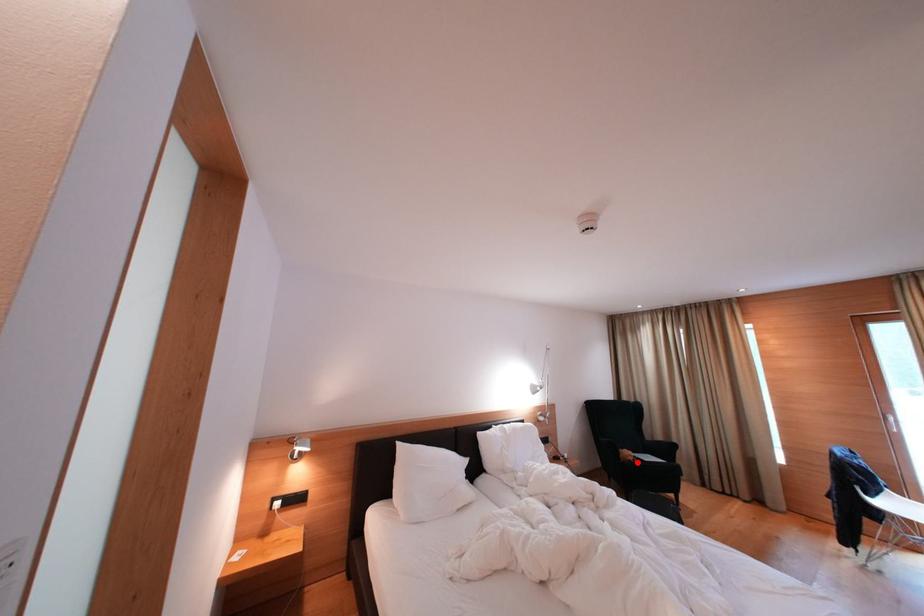
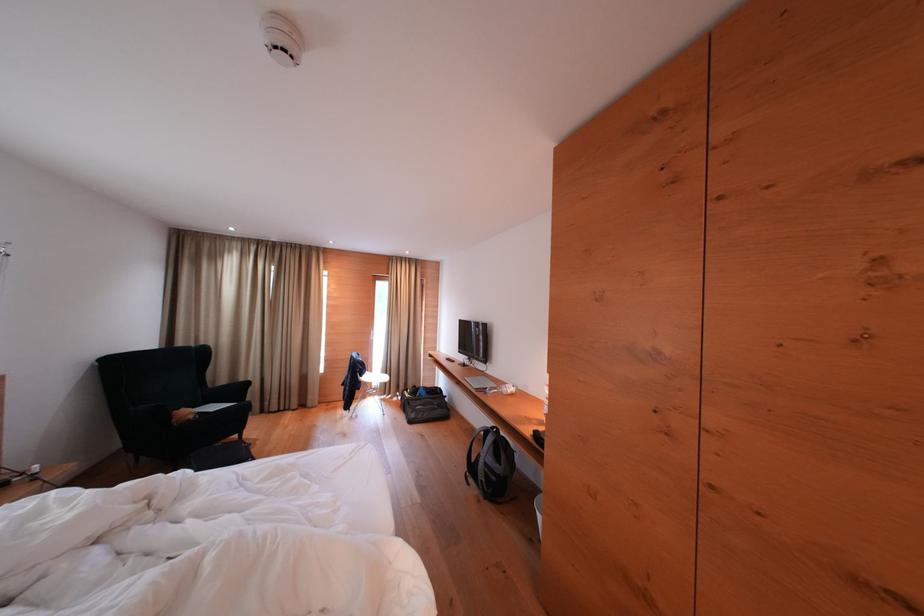
Where in the second image is the point corresponding to the highlighted location from the first image?

(198, 421)